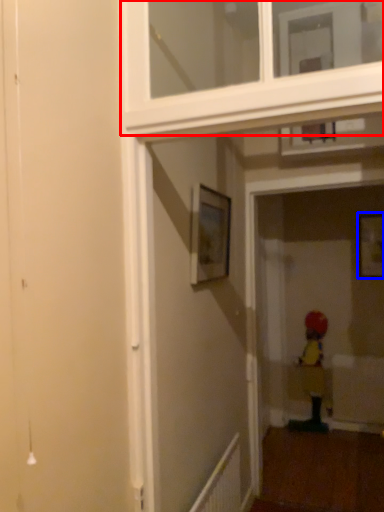
Question: Which of the following is the closest to the observer, window frame (highlighted by a red box) or picture frame (highlighted by a blue box)?

Choices:
 (A) window frame
 (B) picture frame

Answer: (A)